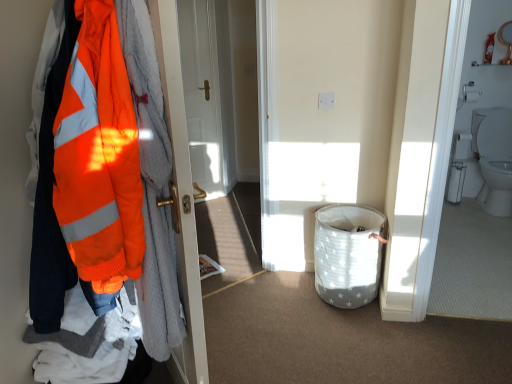
Question: Is white glossy toilet at right wider than white glossy toilet at right?

Choices:
 (A) no
 (B) yes

Answer: (A)

Question: Is white glossy toilet at right behind white glossy toilet at right?

Choices:
 (A) no
 (B) yes

Answer: (A)

Question: Considering the relative sizes of white glossy toilet at right and white glossy toilet at right in the image provided, is white glossy toilet at right taller than white glossy toilet at right?

Choices:
 (A) yes
 (B) no

Answer: (A)

Question: Is white glossy toilet at right turned away from white glossy toilet at right?

Choices:
 (A) no
 (B) yes

Answer: (A)

Question: From a real-world perspective, does white glossy toilet at right stand above white glossy toilet at right?

Choices:
 (A) no
 (B) yes

Answer: (B)

Question: Do you think white glossy door at center is within white glossy toilet at right, or outside of it?

Choices:
 (A) outside
 (B) inside

Answer: (A)

Question: Looking at their shapes, would you say white glossy door at center is wider or thinner than white glossy toilet at right?

Choices:
 (A) thin
 (B) wide

Answer: (A)

Question: Based on their positions, is white glossy door at center located to the left or right of white glossy toilet at right?

Choices:
 (A) right
 (B) left

Answer: (B)

Question: From their relative heights in the image, would you say white glossy door at center is taller or shorter than white glossy toilet at right?

Choices:
 (A) tall
 (B) short

Answer: (A)

Question: Considering their positions, is white glossy door at center located in front of or behind white fabric laundry basket at lower center?

Choices:
 (A) front
 (B) behind

Answer: (B)

Question: From the image's perspective, is white glossy door at center located above or below white fabric laundry basket at lower center?

Choices:
 (A) below
 (B) above

Answer: (B)

Question: From a real-world perspective, relative to white fabric laundry basket at lower center, is white glossy door at center vertically above or below?

Choices:
 (A) below
 (B) above

Answer: (B)

Question: Based on their sizes in the image, would you say white glossy door at center is bigger or smaller than white fabric laundry basket at lower center?

Choices:
 (A) small
 (B) big

Answer: (A)

Question: Visually, is white fabric laundry basket at lower center positioned to the left or to the right of high-visibility orange jacket at left?

Choices:
 (A) right
 (B) left

Answer: (A)

Question: In the image, is white fabric laundry basket at lower center positioned in front of or behind high-visibility orange jacket at left?

Choices:
 (A) front
 (B) behind

Answer: (B)